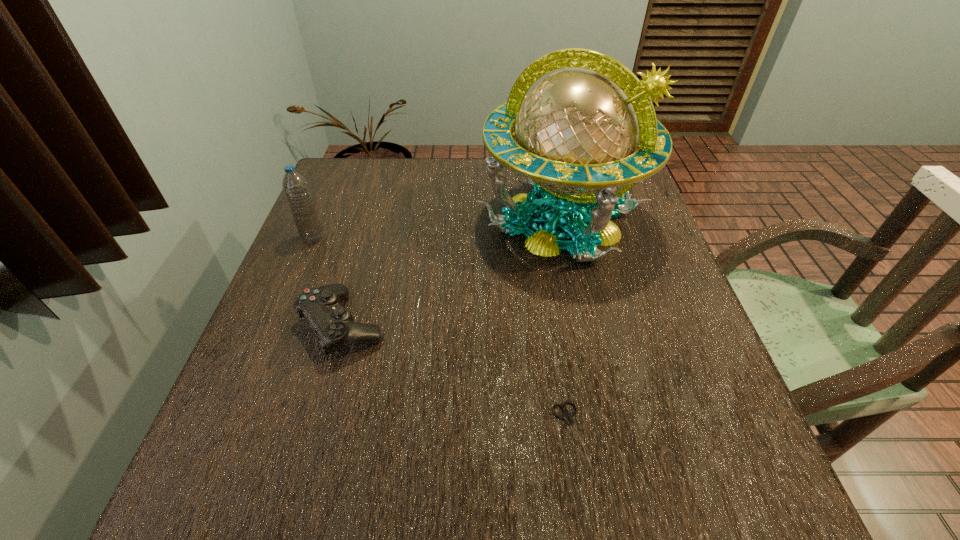
The height and width of the screenshot is (540, 960). I want to click on vacant region located 0.310m on the left of the nearest object, so click(374, 433).

At what (x,y) coordinates should I click in order to perform the action: click on object at the far edge. Please return your answer as a coordinate pair (x, y). The height and width of the screenshot is (540, 960). Looking at the image, I should click on (574, 136).

I want to click on object that is at the near edge, so click(x=566, y=415).

The height and width of the screenshot is (540, 960). Find the location of `water bottle that is at the left edge`. water bottle that is at the left edge is located at coordinates (295, 187).

This screenshot has width=960, height=540. What are the coordinates of `control that is positioned at the left edge` in the screenshot? It's located at (334, 325).

Locate an element on the screen. The height and width of the screenshot is (540, 960). object that is at the right edge is located at coordinates (574, 136).

What are the coordinates of `object that is at the far right corner` in the screenshot? It's located at (574, 136).

This screenshot has width=960, height=540. Find the location of `blank space at the far edge`. blank space at the far edge is located at coordinates [411, 183].

Where is `vacant space at the near edge of the desktop`? This screenshot has height=540, width=960. vacant space at the near edge of the desktop is located at coordinates (608, 502).

In the image, there is a desktop. At what (x,y) coordinates should I click in order to perform the action: click on vacant space at the left edge. Please return your answer as a coordinate pair (x, y). The width and height of the screenshot is (960, 540). Looking at the image, I should click on (320, 255).